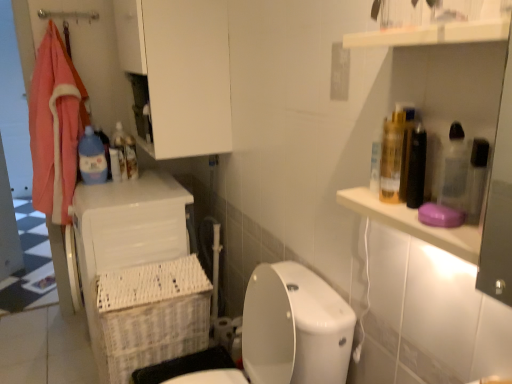
Question: Is white plastic laundry basket at lower left inside the boundaries of white glossy toilet at lower center, or outside?

Choices:
 (A) outside
 (B) inside

Answer: (A)

Question: From a real-world perspective, is white plastic laundry basket at lower left physically located above or below white glossy toilet at lower center?

Choices:
 (A) above
 (B) below

Answer: (B)

Question: Estimate the real-world distances between objects in this image. Which object is closer to the white matte toilet paper at lower center?

Choices:
 (A) white glossy toilet at lower center
 (B) white wicker basket at lower left
 (C) white matte cabinet at upper center
 (D) blue plastic bottle at upper left
 (E) white plastic laundry basket at lower left

Answer: (B)

Question: Which object is the farthest from the blue plastic bottle at left?

Choices:
 (A) blue plastic bottle at upper left
 (B) white matte cabinet at upper center
 (C) white plastic laundry basket at lower left
 (D) white wicker basket at lower left
 (E) white glossy toilet at lower center

Answer: (E)